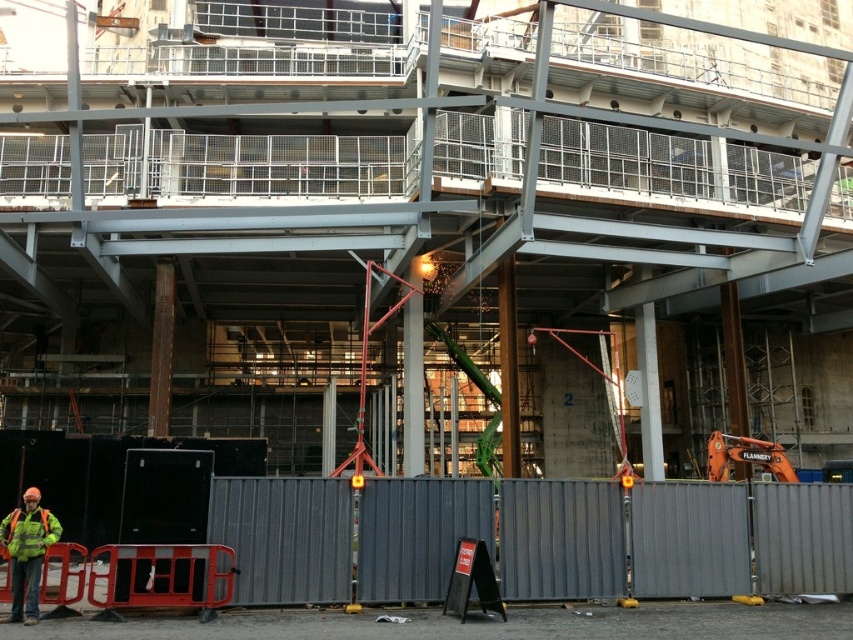
Question: Does gray corrugated fence at center come in front of high visibility fabric safety vest at lower left?

Choices:
 (A) yes
 (B) no

Answer: (B)

Question: Which object appears closest to the camera in this image?

Choices:
 (A) high visibility fabric safety vest at lower left
 (B) gray corrugated fence at center

Answer: (A)

Question: Can you confirm if reflective yellow vest at lower left is smaller than high visibility fabric safety vest at lower left?

Choices:
 (A) yes
 (B) no

Answer: (B)

Question: Which object is closer to the camera taking this photo?

Choices:
 (A) reflective yellow vest at lower left
 (B) high visibility fabric safety vest at lower left

Answer: (A)

Question: Is the position of gray corrugated fence at center less distant than that of high visibility fabric safety vest at lower left?

Choices:
 (A) no
 (B) yes

Answer: (A)

Question: Which of the following is the farthest from the observer?

Choices:
 (A) (793, 563)
 (B) (35, 538)

Answer: (A)